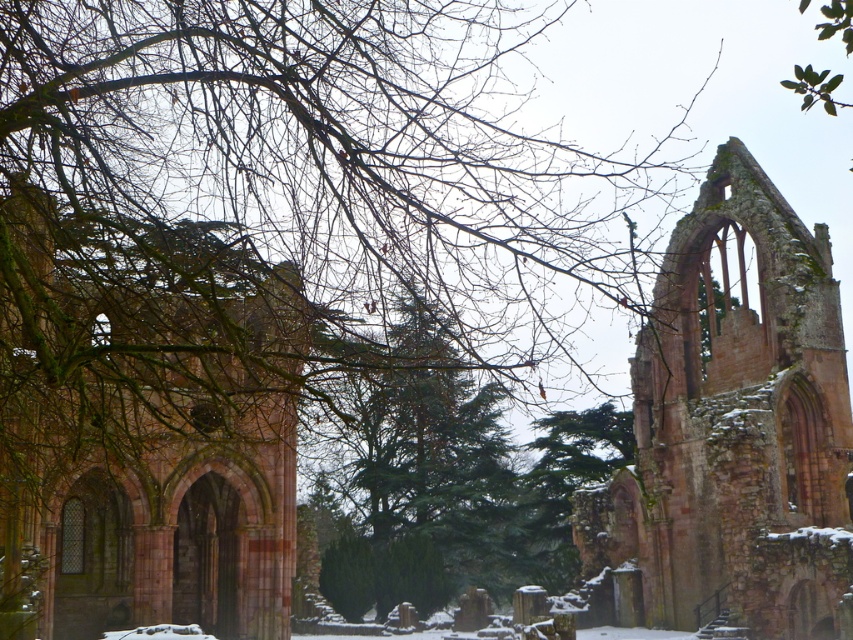
You are an architect assessing the structural integrity of the ruins. You notice the rustic stone arches at center and the rustic stone ruins at center. Which of these two has a greater width according to your measurements?

The rustic stone arches at center has a larger width than the rustic stone ruins at center according to the description.

You are an architect examining the ruins of an old church. You notice the rustic stone arches at center and the rustic stone ruins at center. Based on their positions, which one is situated higher up in the structure?

The rustic stone arches at center are located above the rustic stone ruins at center, meaning they are situated higher up in the structure.